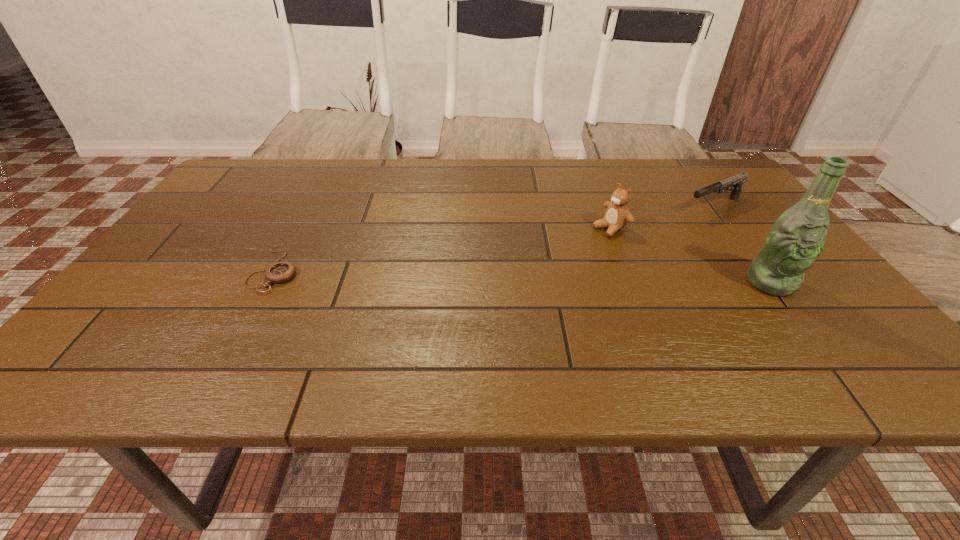
Locate an element on the screen. This screenshot has width=960, height=540. vacant space at the left edge of the desktop is located at coordinates (243, 198).

Identify the location of free space at the far left corner of the desktop. This screenshot has height=540, width=960. (263, 174).

At what (x,y) coordinates should I click in order to perform the action: click on vacant space at the near left corner of the desktop. Please return your answer as a coordinate pair (x, y). Image resolution: width=960 pixels, height=540 pixels. Looking at the image, I should click on (155, 314).

At what (x,y) coordinates should I click in order to perform the action: click on vacant point at the far right corner. Please return your answer as a coordinate pair (x, y). Looking at the image, I should click on (741, 191).

The image size is (960, 540). In order to click on vacant area that lies between the second tallest object and the beer bottle in this screenshot , I will do `click(690, 255)`.

This screenshot has width=960, height=540. I want to click on free space between the shortest object and the teddy bear, so click(443, 249).

Locate an element on the screen. The height and width of the screenshot is (540, 960). vacant space in between the teddy bear and the third tallest object is located at coordinates (662, 217).

Identify the location of free area in between the tallest object and the shortest object. This screenshot has height=540, width=960. (523, 277).

The image size is (960, 540). I want to click on blank region between the teddy bear and the beer bottle, so click(690, 255).

Identify the location of vacant region between the gun and the shortest object. Image resolution: width=960 pixels, height=540 pixels. (494, 239).